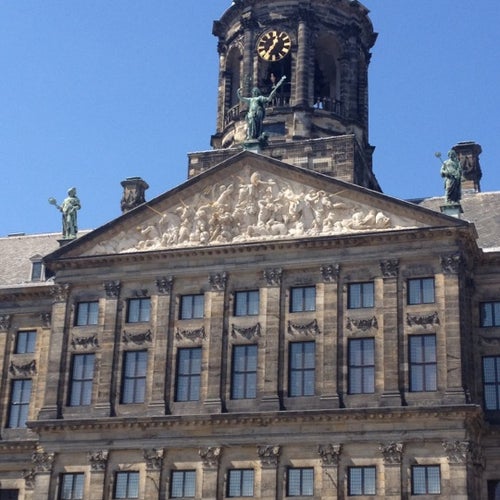
Identify the location of clock. (274, 48).